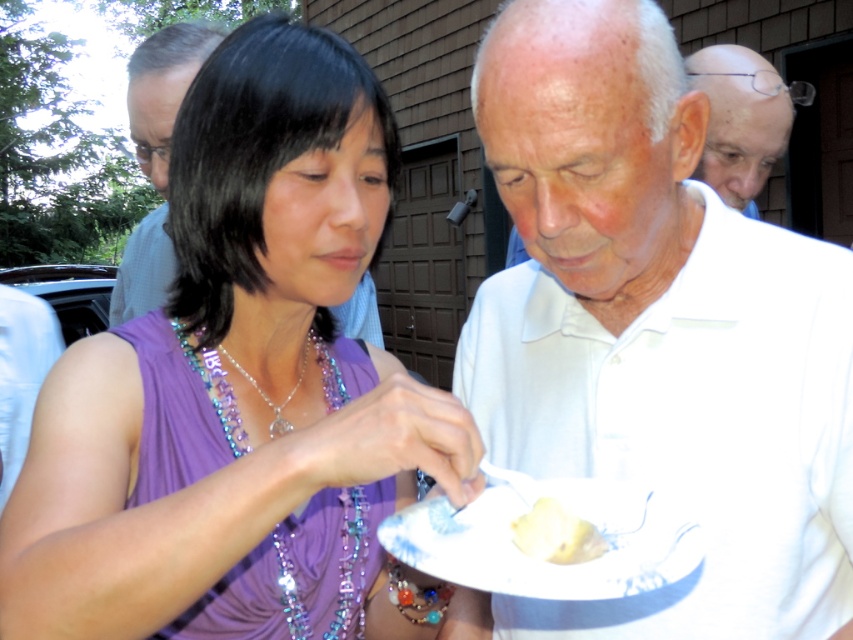
Who is shorter, purple fabric dress at center or silver/glass pendant at center?

silver/glass pendant at center is shorter.

Is purple fabric dress at center to the right of silver/glass pendant at center from the viewer's perspective?

Indeed, purple fabric dress at center is positioned on the right side of silver/glass pendant at center.

What do you see at coordinates (231, 355) in the screenshot? I see `purple fabric dress at center` at bounding box center [231, 355].

Where is `purple fabric dress at center`? purple fabric dress at center is located at coordinates (231, 355).

Locate an element on the screen. This screenshot has width=853, height=640. gray fabric shirt at upper left is located at coordinates (163, 90).

Can you confirm if gray fabric shirt at upper left is bigger than shiny plastic beads at center?

Correct, gray fabric shirt at upper left is larger in size than shiny plastic beads at center.

Who is more distant from viewer, (155, 262) or (283, 550)?

The point (155, 262) is behind.

What are the coordinates of `gray fabric shirt at upper left` in the screenshot? It's located at (163, 90).

Can you confirm if white porcelain plate at center is bigger than bald head at upper right?

No.

Is white porcelain plate at center positioned at the back of bald head at upper right?

No, white porcelain plate at center is in front of bald head at upper right.

In order to click on white porcelain plate at center in this screenshot , I will do `click(541, 560)`.

I want to click on white porcelain plate at center, so click(x=541, y=560).